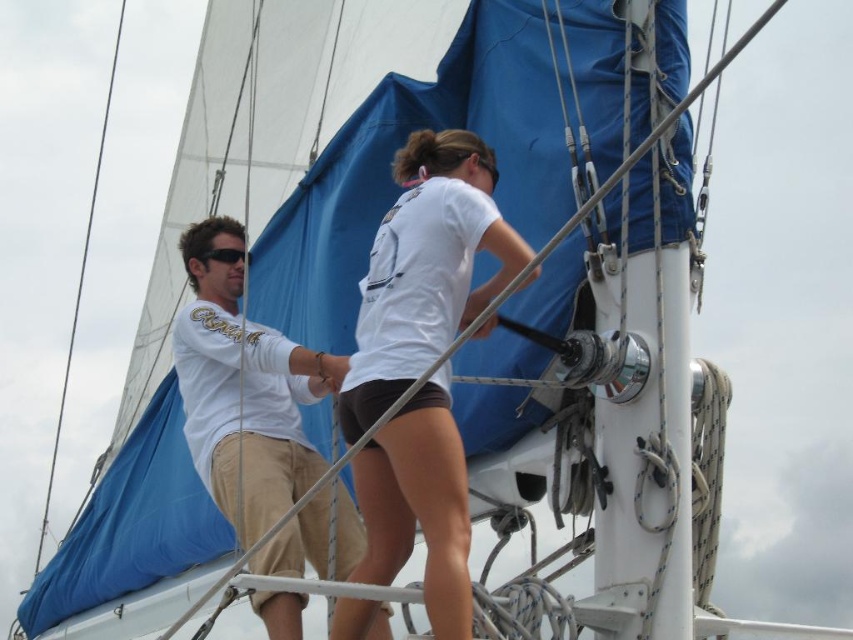
This screenshot has height=640, width=853. Describe the element at coordinates (242, 390) in the screenshot. I see `white cotton shirt at center` at that location.

Who is higher up, white cotton shirt at center or black plastic sunglasses at left?

black plastic sunglasses at left

Between point (236, 385) and point (218, 259), which one is positioned behind?

The point (218, 259) is behind.

Where is `white cotton shirt at center`? Image resolution: width=853 pixels, height=640 pixels. white cotton shirt at center is located at coordinates (242, 390).

Does white matte shorts at center have a lesser width compared to white cotton shirt at center?

Indeed, white matte shorts at center has a lesser width compared to white cotton shirt at center.

Is point (436, 264) farther from camera compared to point (277, 348)?

No, (436, 264) is closer to viewer.

This screenshot has height=640, width=853. I want to click on white matte shorts at center, so click(x=425, y=269).

The width and height of the screenshot is (853, 640). Describe the element at coordinates (425, 269) in the screenshot. I see `white matte shorts at center` at that location.

Does white matte shorts at center appear under black plastic sunglasses at left?

Correct, white matte shorts at center is located below black plastic sunglasses at left.

Image resolution: width=853 pixels, height=640 pixels. In order to click on white matte shorts at center in this screenshot , I will do `click(425, 269)`.